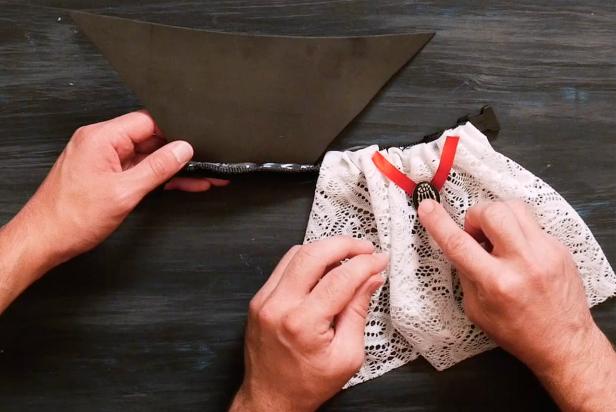
I want to click on pendant, so click(x=426, y=194).